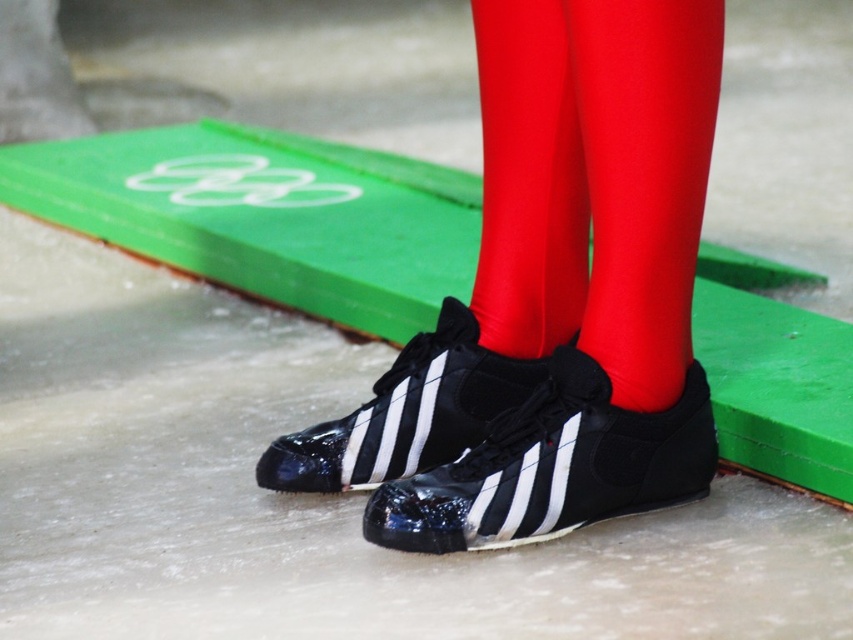
Question: Is shiny black sneakers at center to the left of black shiny sneakers at center from the viewer's perspective?

Choices:
 (A) no
 (B) yes

Answer: (A)

Question: Does black shiny sneakers at center have a smaller size compared to black rubber shoe at center?

Choices:
 (A) yes
 (B) no

Answer: (B)

Question: Which object is farther from the camera taking this photo?

Choices:
 (A) shiny black sneakers at center
 (B) shiny red tights at center

Answer: (A)

Question: Which object is farther from the camera taking this photo?

Choices:
 (A) shiny black sneakers at center
 (B) black rubber shoe at center
 (C) matte black sock at center

Answer: (B)

Question: Which object is farther from the camera taking this photo?

Choices:
 (A) black shiny sneakers at center
 (B) black rubber shoe at center
 (C) shiny black sneakers at center

Answer: (B)

Question: Can you confirm if shiny black sneakers at center is thinner than black rubber shoe at center?

Choices:
 (A) yes
 (B) no

Answer: (B)